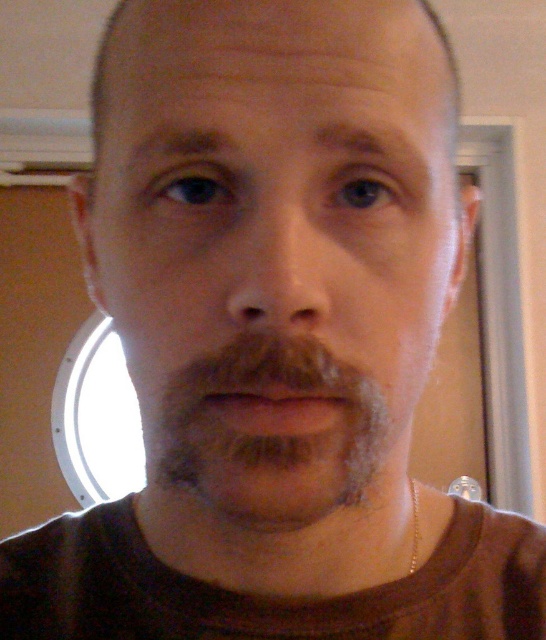
Question: Does gray fuzzy beard at center appear over brown matte lips at center?

Choices:
 (A) no
 (B) yes

Answer: (A)

Question: Which point appears farthest from the camera in this image?

Choices:
 (A) (355, 412)
 (B) (353, 468)

Answer: (B)

Question: Among these points, which one is farthest from the camera?

Choices:
 (A) click(x=257, y=3)
 (B) click(x=216, y=492)

Answer: (B)

Question: Among these points, which one is farthest from the camera?

Choices:
 (A) (335, 164)
 (B) (311, 426)
 (C) (221, 365)

Answer: (A)

Question: Considering the relative positions of smooth skin face at center and brown matte lips at center in the image provided, where is smooth skin face at center located with respect to brown matte lips at center?

Choices:
 (A) left
 (B) right

Answer: (A)

Question: Is gray fuzzy beard at center below brown matte lips at center?

Choices:
 (A) yes
 (B) no

Answer: (A)